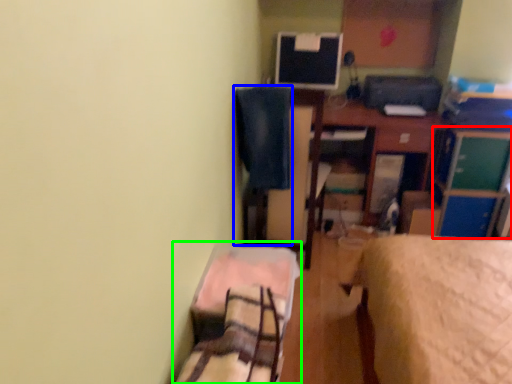
Question: Which is farther away from file cabinet (highlighted by a red box)? swivel chair (highlighted by a blue box) or bed (highlighted by a green box)?

Choices:
 (A) swivel chair
 (B) bed

Answer: (B)